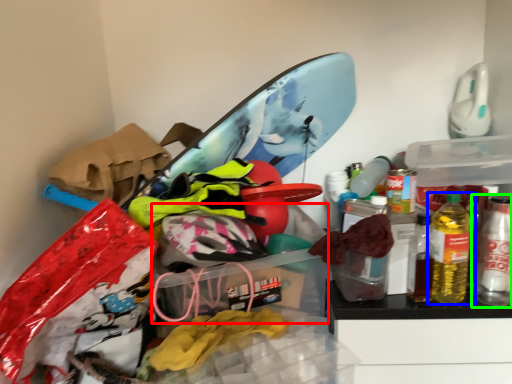
Question: Which object is positioned farthest from storage box (highlighted by a red box)? Select from bottle (highlighted by a blue box) and bottle (highlighted by a green box).

Choices:
 (A) bottle
 (B) bottle

Answer: (B)